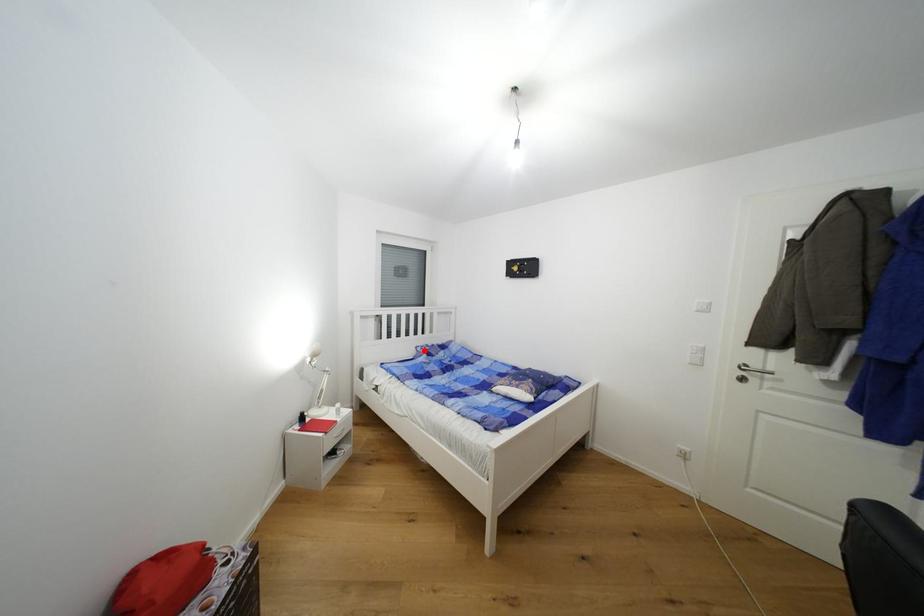
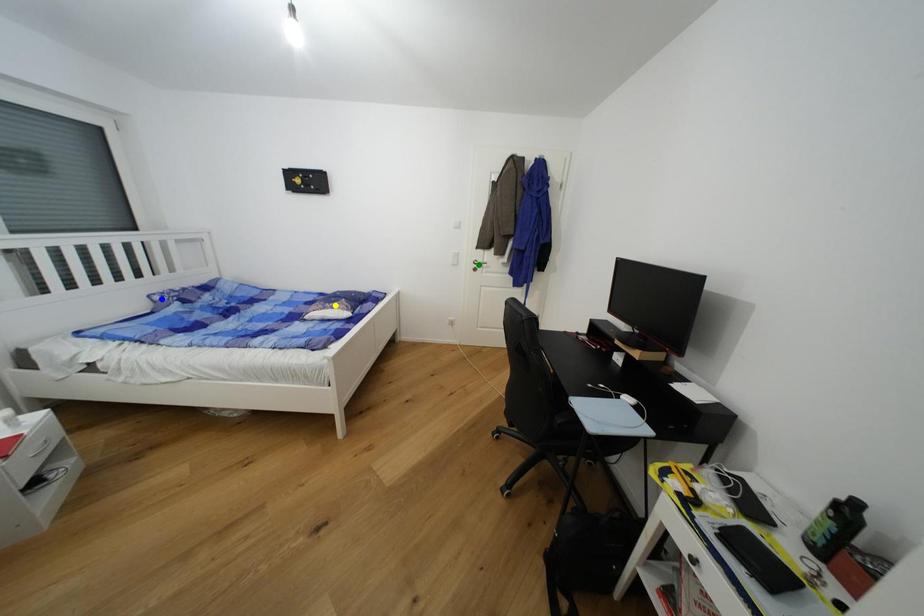
Question: I am providing you with two images of the same scene from different viewpoints. A red point is marked on the first image. You are given multiple points on the second image. Which spot in image 2 lines up with the point in image 1?

Choices:
 (A) blue point
 (B) green point
 (C) yellow point

Answer: (A)